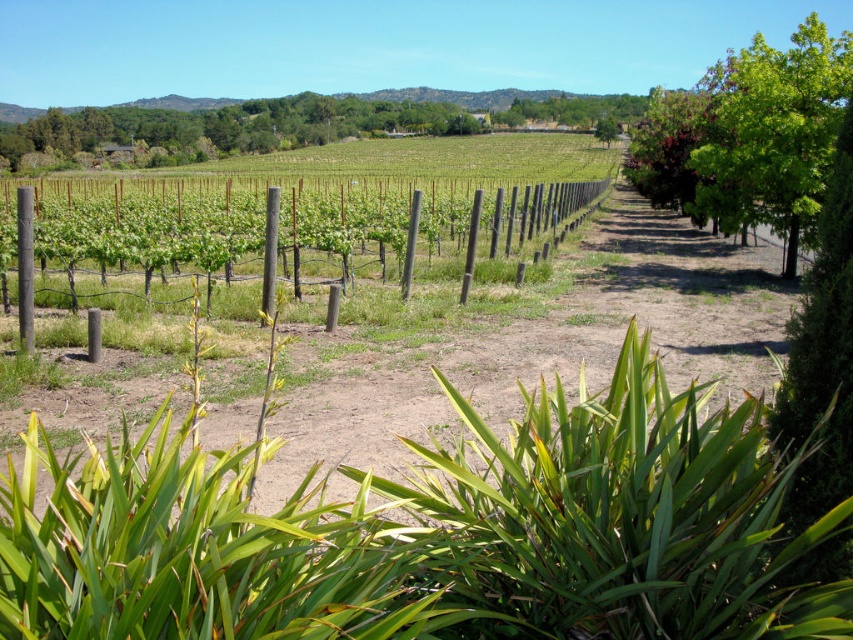
Question: Can you confirm if green leafy tree at right is bigger than green leafy tree at upper center?

Choices:
 (A) yes
 (B) no

Answer: (A)

Question: Can you confirm if green leafy tree at upper center is smaller than green leafy tree at center-right?

Choices:
 (A) yes
 (B) no

Answer: (B)

Question: Considering the real-world distances, which object is closest to the green leafy tree at right?

Choices:
 (A) green leafy tree at upper center
 (B) green leafy tree at center-right

Answer: (B)

Question: In this image, where is green leafy tree at right located relative to green leafy tree at center-right?

Choices:
 (A) right
 (B) left

Answer: (A)

Question: Which point is closer to the camera?

Choices:
 (A) (598, 132)
 (B) (741, 147)

Answer: (B)

Question: Which point appears farthest from the camera in this image?

Choices:
 (A) (601, 128)
 (B) (746, 84)

Answer: (A)